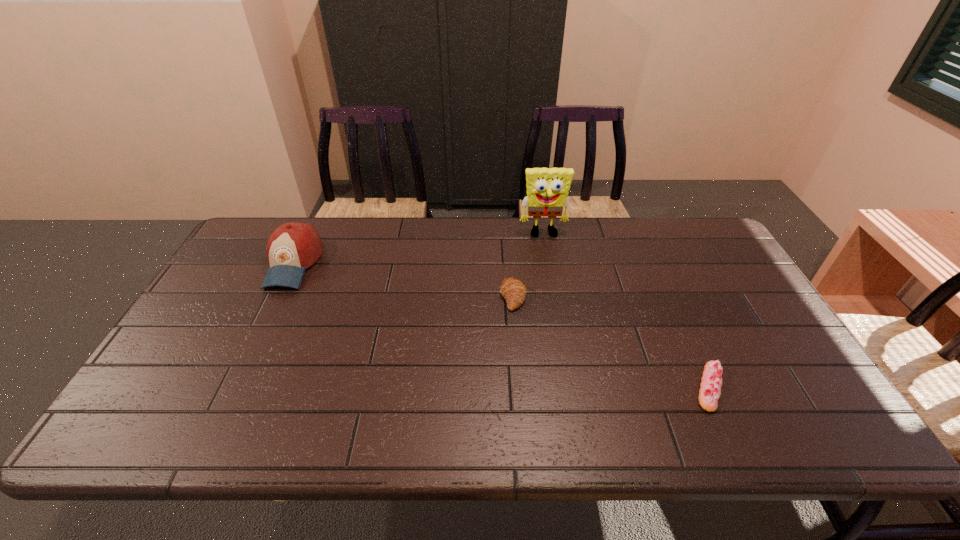
What are the coordinates of `vacant space that's between the crescent roll and the baseball cap` in the screenshot? It's located at (403, 280).

The height and width of the screenshot is (540, 960). Identify the location of unoccupied area between the crescent roll and the rightmost object. (612, 342).

What are the coordinates of `vacant point located between the tallest object and the baseball cap` in the screenshot? It's located at (419, 249).

Locate an element on the screen. free spot between the crescent roll and the nearest object is located at coordinates (612, 342).

This screenshot has width=960, height=540. I want to click on empty location between the rightmost object and the third shortest object, so click(502, 326).

Identify the location of free space between the second tallest object and the tallest object. (419, 249).

You are a GUI agent. You are given a task and a screenshot of the screen. Output one action in this format:
    pyautogui.click(x=<x>, y=<y>)
    Task: Click on the free space between the tallest object and the eclair
    The image size is (960, 540).
    Given the screenshot: What is the action you would take?
    pyautogui.click(x=627, y=310)

The height and width of the screenshot is (540, 960). Identify the location of empty space that is in between the baseball cap and the nearest object. (502, 326).

Locate an element on the screen. The image size is (960, 540). blank region between the sponge and the leftmost object is located at coordinates (419, 249).

Identify the location of vacant space that's between the crescent roll and the baseball cap. Image resolution: width=960 pixels, height=540 pixels. [x=403, y=280].